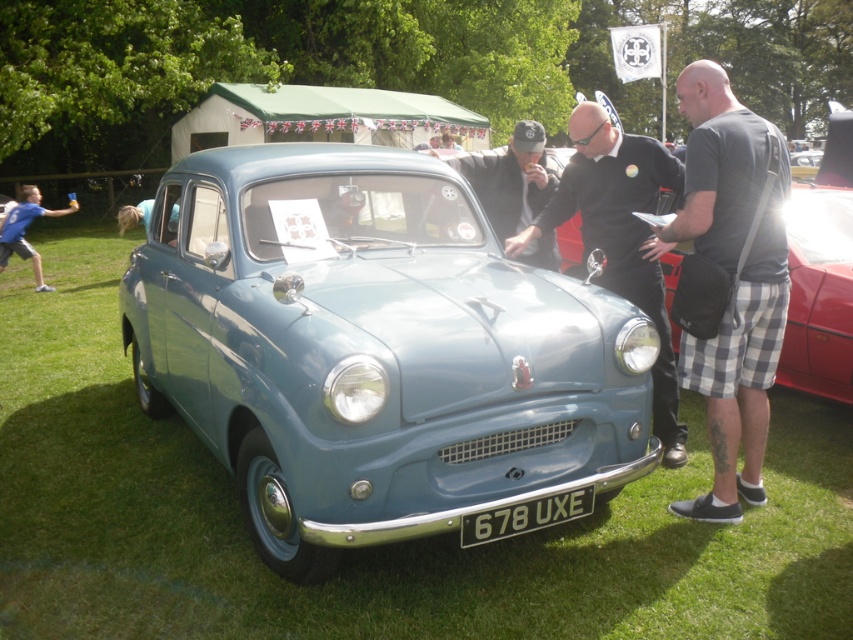
Can you confirm if dark gray t-shirt at center is smaller than blue t-shirt at left?

Actually, dark gray t-shirt at center might be larger than blue t-shirt at left.

Between dark gray t-shirt at center and blue t-shirt at left, which one is positioned higher?

blue t-shirt at left

The width and height of the screenshot is (853, 640). What are the coordinates of `dark gray t-shirt at center` in the screenshot? It's located at (732, 280).

Is point (198, 156) positioned after point (635, 269)?

Yes, point (198, 156) is farther from viewer.

Who is more distant from viewer, (386, 285) or (672, 465)?

Positioned behind is point (672, 465).

Locate an element on the screen. The width and height of the screenshot is (853, 640). matte blue car at center is located at coordinates (373, 349).

From the picture: Does black leather jacket at center appear over metallic silver car at center?

Actually, black leather jacket at center is below metallic silver car at center.

Identify the location of black leather jacket at center. (621, 236).

Where is `black leather jacket at center`? The height and width of the screenshot is (640, 853). black leather jacket at center is located at coordinates (621, 236).

This screenshot has width=853, height=640. I want to click on black leather jacket at center, so (621, 236).